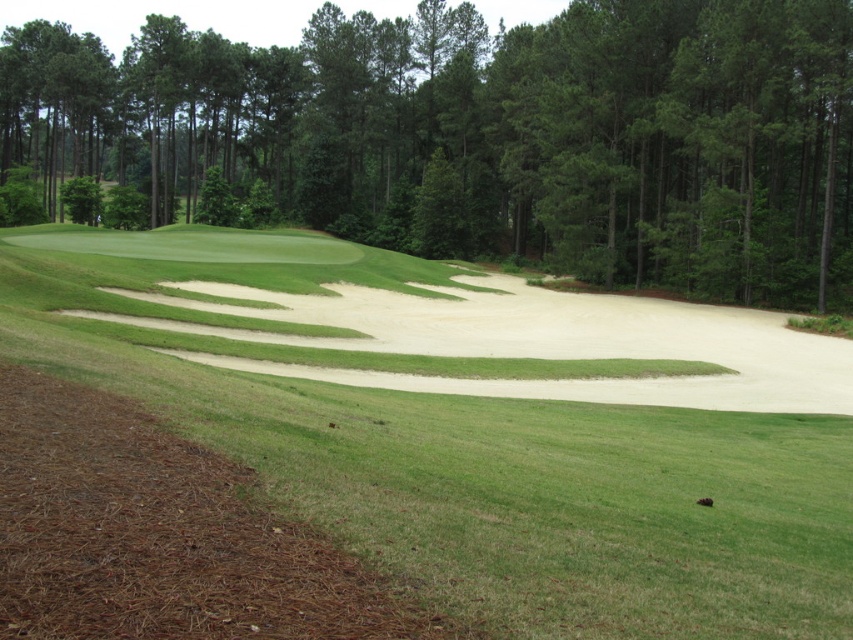
Question: Does sandy beige sand trap at center appear under green leafy tree at center?

Choices:
 (A) yes
 (B) no

Answer: (A)

Question: Is sandy beige sand trap at center closer to the viewer compared to green leafy tree at center?

Choices:
 (A) yes
 (B) no

Answer: (A)

Question: Which of the following is the closest to the observer?

Choices:
 (A) sandy beige sand trap at center
 (B) green leafy tree at center

Answer: (A)

Question: Does sandy beige sand trap at center lie behind green leafy tree at center?

Choices:
 (A) yes
 (B) no

Answer: (B)